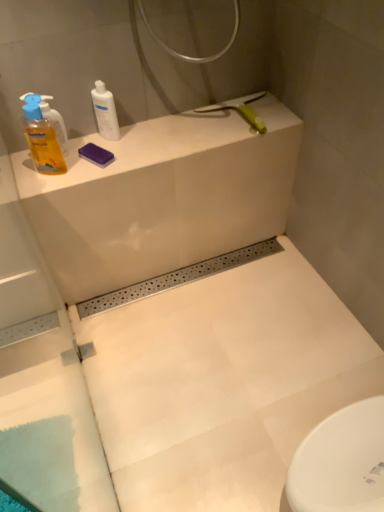
Identify the location of vacant space to the right of white glossy bottle at upper left, arranged as the 2th cleaning product when viewed from the left. Image resolution: width=384 pixels, height=512 pixels. (157, 136).